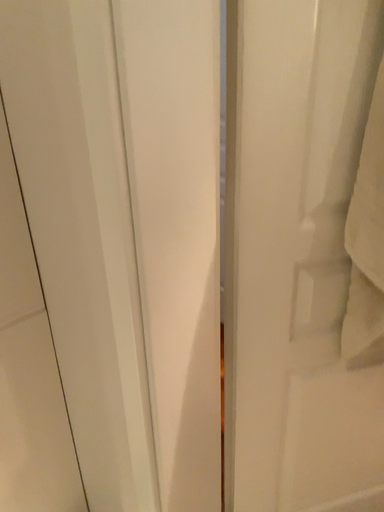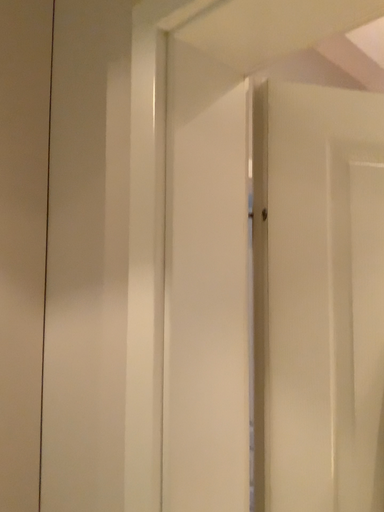
Question: How did the camera likely rotate when shooting the video?

Choices:
 (A) rotated upward
 (B) rotated downward

Answer: (A)